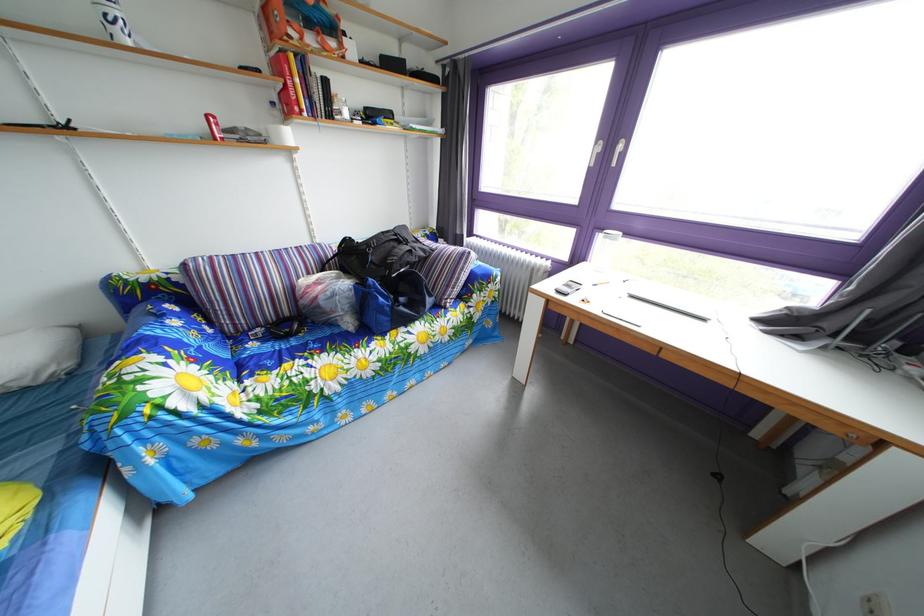
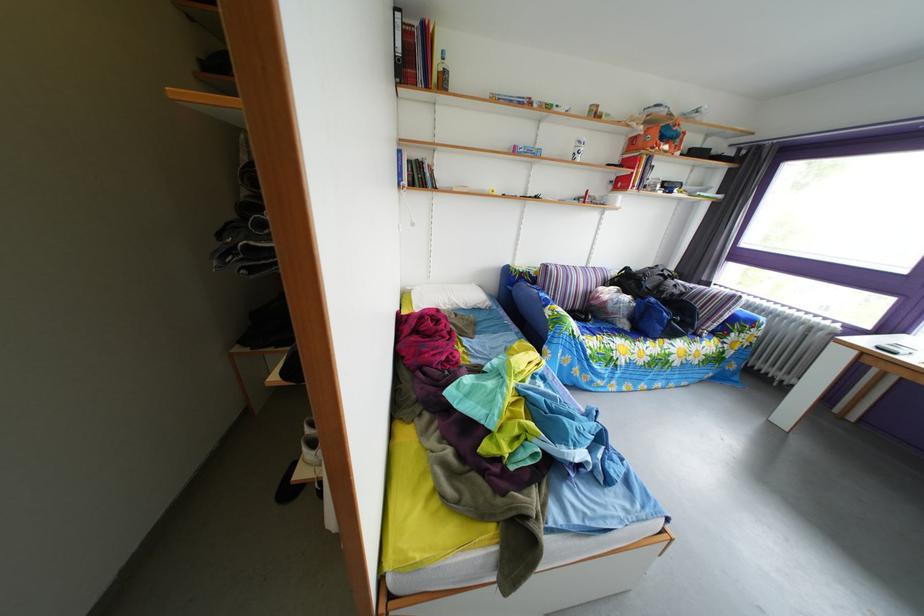
The point at (320, 33) is marked in the first image. Where is the corresponding point in the second image?

(673, 147)